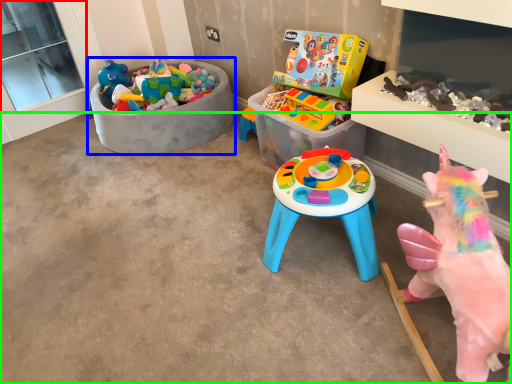
Question: Which is nearer to the window screen (highlighted by a red box)? toy (highlighted by a blue box) or concrete (highlighted by a green box).

Choices:
 (A) toy
 (B) concrete

Answer: (A)